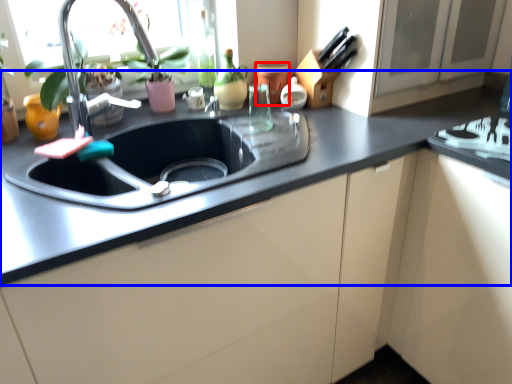
Question: Among these objects, which one is nearest to the camera, appliance (highlighted by a red box) or countertop (highlighted by a blue box)?

Choices:
 (A) appliance
 (B) countertop

Answer: (B)